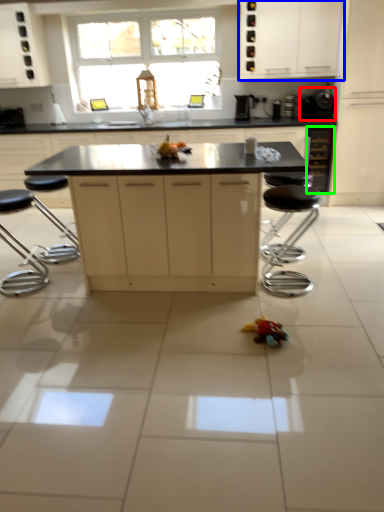
Question: Which object is positioned closest to appliance (highlighted by a red box)? Select from cabinetry (highlighted by a blue box) and cabinetry (highlighted by a green box).

Choices:
 (A) cabinetry
 (B) cabinetry

Answer: (B)